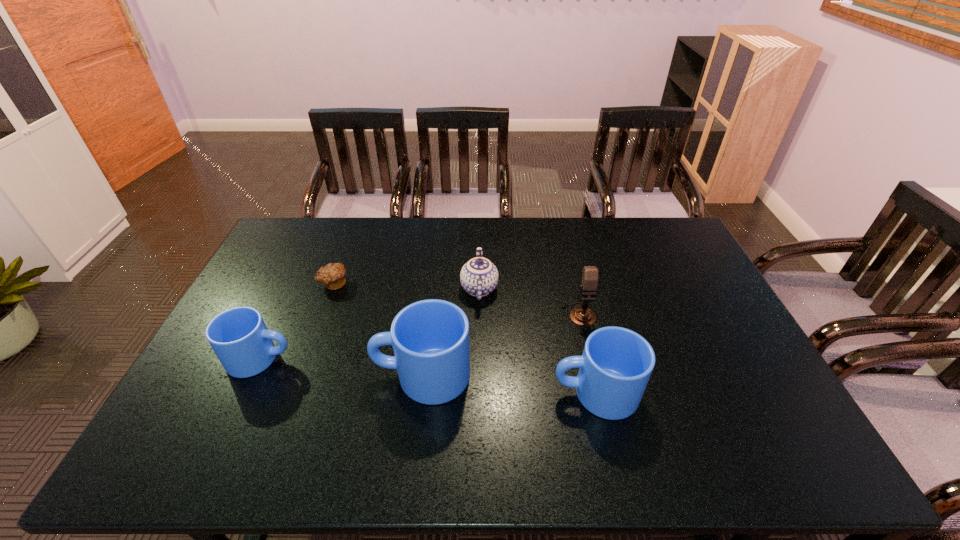
The width and height of the screenshot is (960, 540). I want to click on free point located 0.280m on the side of the rightmost mug with the handle, so click(x=445, y=393).

Find the location of `free space located 0.380m on the side of the rightmost mug with the handle`. free space located 0.380m on the side of the rightmost mug with the handle is located at coordinates (407, 393).

At what (x,y) coordinates should I click in order to perform the action: click on vacant space located 0.300m on the side of the rightmost mug with the handle. Please return your answer as a coordinate pair (x, y). The image size is (960, 540). Looking at the image, I should click on (438, 393).

Image resolution: width=960 pixels, height=540 pixels. What are the coordinates of `vacant region located on the front of the muffin` in the screenshot? It's located at (324, 307).

Locate an element on the screen. This screenshot has height=540, width=960. vacant space situated at the spout of the chinaware is located at coordinates (479, 232).

Identify the location of free space located 0.060m at the spout of the chinaware. The image size is (960, 540). (479, 258).

Locate an element on the screen. vacant space located at the spout of the chinaware is located at coordinates click(479, 259).

Where is `vacant area situated on the front-facing side of the microphone`? The image size is (960, 540). vacant area situated on the front-facing side of the microphone is located at coordinates 597,394.

The image size is (960, 540). In order to click on object located at the left edge in this screenshot , I will do `click(239, 337)`.

The width and height of the screenshot is (960, 540). In order to click on free space at the far edge in this screenshot , I will do `click(357, 224)`.